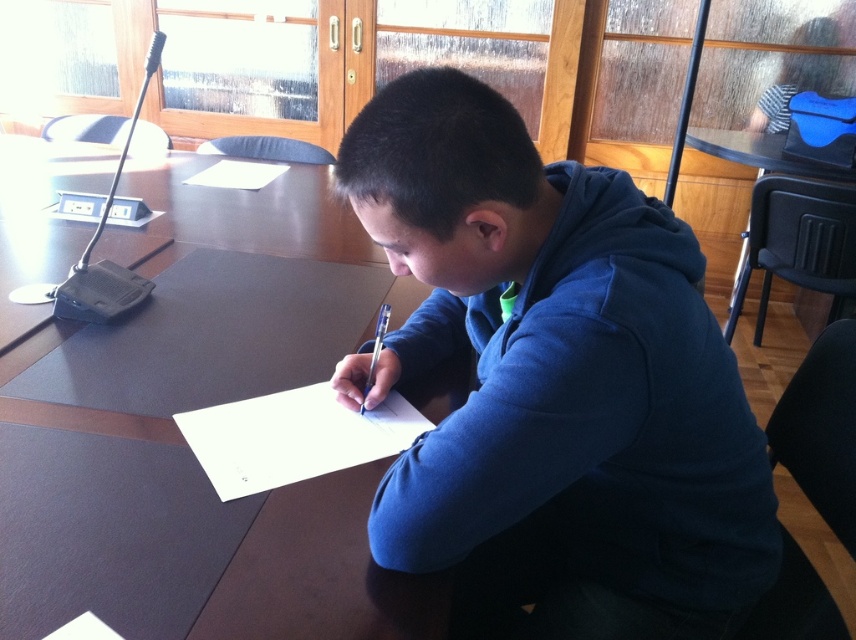
Question: Is dark brown wood table at center wider than transparent glass table at center?

Choices:
 (A) yes
 (B) no

Answer: (A)

Question: Is the position of blue fleece jacket at center more distant than that of dark brown wood table at center?

Choices:
 (A) yes
 (B) no

Answer: (A)

Question: Which is farther from the blue fleece jacket at center?

Choices:
 (A) dark brown wood table at center
 (B) transparent glass table at center

Answer: (B)

Question: Among these points, which one is nearest to the camera?

Choices:
 (A) (235, 330)
 (B) (446, 444)

Answer: (B)

Question: Which point is farther to the camera?

Choices:
 (A) blue fleece jacket at center
 (B) dark brown wood table at center
 (C) transparent glass table at center

Answer: (C)

Question: Does blue fleece jacket at center appear on the left side of dark brown wood table at center?

Choices:
 (A) yes
 (B) no

Answer: (B)